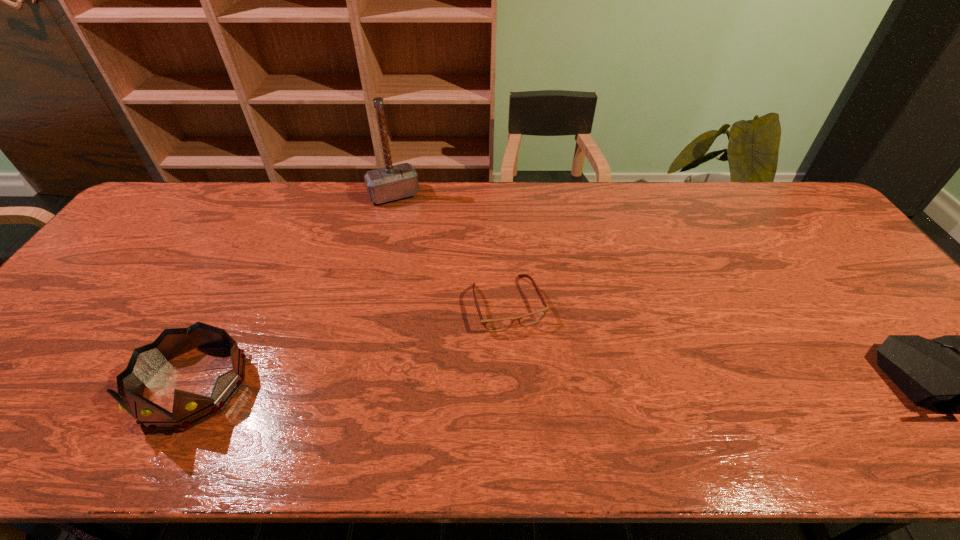
The height and width of the screenshot is (540, 960). In order to click on vacant space located on the front-facing side of the third nearest object in this screenshot , I will do `click(534, 370)`.

The height and width of the screenshot is (540, 960). I want to click on vacant space located 0.170m on the front-facing side of the third nearest object, so click(x=542, y=393).

Locate an element on the screen. The image size is (960, 540). object located in the far edge section of the desktop is located at coordinates (390, 183).

Where is `object that is at the near edge`? The image size is (960, 540). object that is at the near edge is located at coordinates (189, 410).

Where is `free spot at the far edge of the desktop`? free spot at the far edge of the desktop is located at coordinates pyautogui.click(x=312, y=221).

Where is `blank area at the near edge`? blank area at the near edge is located at coordinates (648, 396).

Where is `vacant point at the left edge`? vacant point at the left edge is located at coordinates (84, 306).

Where is `vacant area at the far left corner`? The width and height of the screenshot is (960, 540). vacant area at the far left corner is located at coordinates (163, 192).

At what (x,y) coordinates should I click in order to perform the action: click on vacant region between the farthest object and the third tallest object. Please return your answer as a coordinate pair (x, y). The height and width of the screenshot is (540, 960). Looking at the image, I should click on (294, 291).

I want to click on free space between the second object from right to left and the tallest object, so click(451, 249).